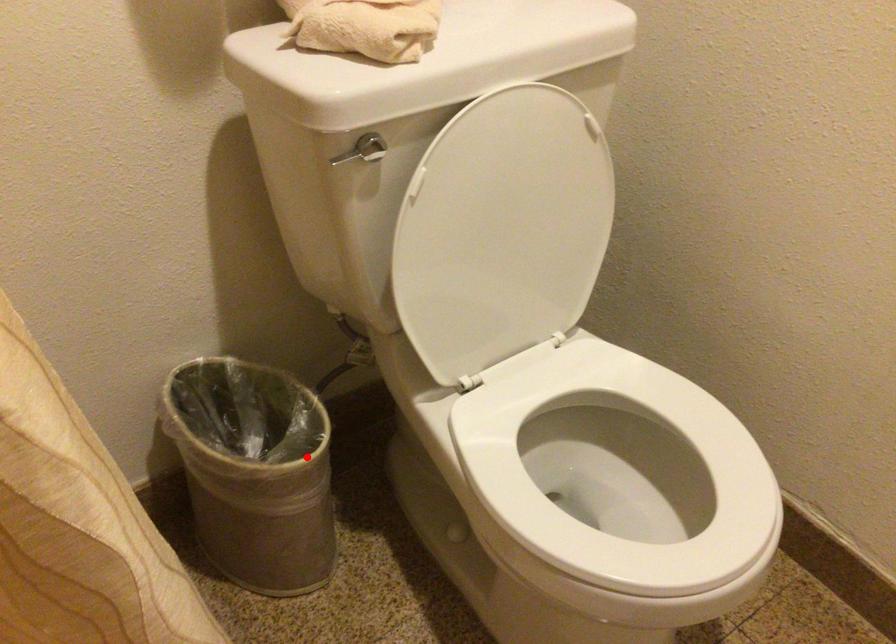
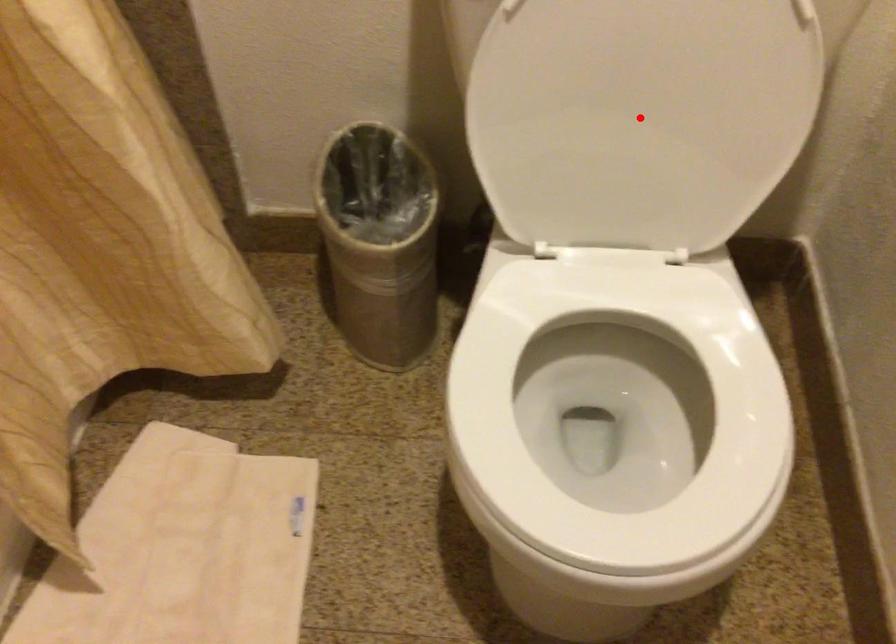
I am providing you with two images of the same scene from different viewpoints. A red point is marked on the first image and another point is marked on the second image. Do the highlighted points in image1 and image2 indicate the same real-world spot?

No